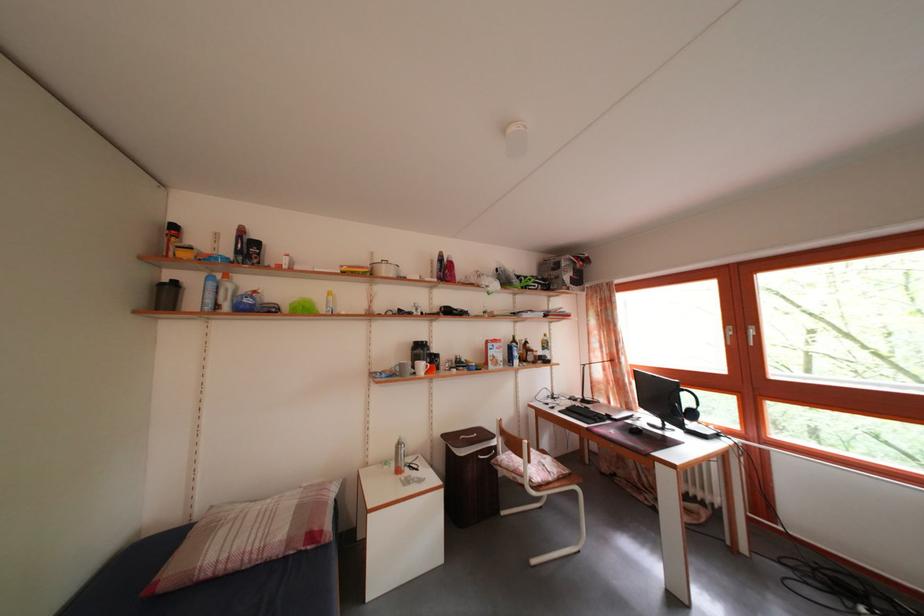
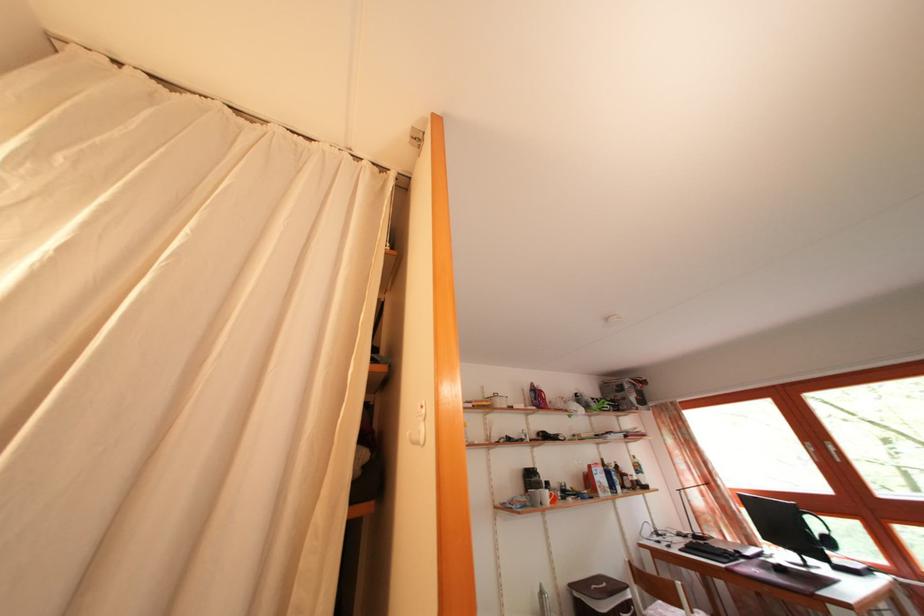
Where in the second image is the point corresponding to (x=699, y=421) from the first image?

(837, 549)